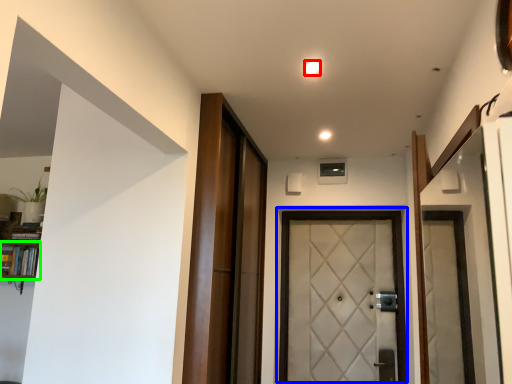
Question: Which object is positioned closest to light (highlighted by a red box)? Select from door (highlighted by a blue box) and bookshelf (highlighted by a green box).

Choices:
 (A) door
 (B) bookshelf

Answer: (A)